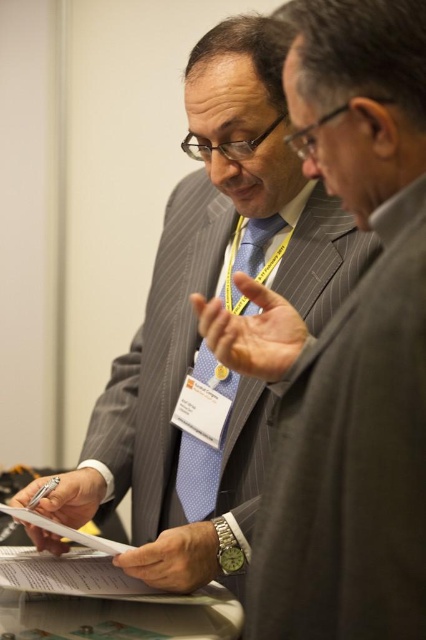
Where is the pinstriped wool suit at center located in the image?

The pinstriped wool suit at center is located at point [351,460].

You are a tailor observing two men in a formal setting. You need to determine which item has a smaller width between the pinstriped wool suit at center and the blue dotted tie at center. Which one is it?

The pinstriped wool suit at center has a lesser width compared to the blue dotted tie at center, so the pinstriped wool suit at center is the one with the smaller width.

You are a fashion designer observing two men in a formal setting. You notice the pinstriped wool suit at center and the blue dotted tie at center. Which clothing item is shorter in length?

The pinstriped wool suit at center is shorter than the blue dotted tie at center.